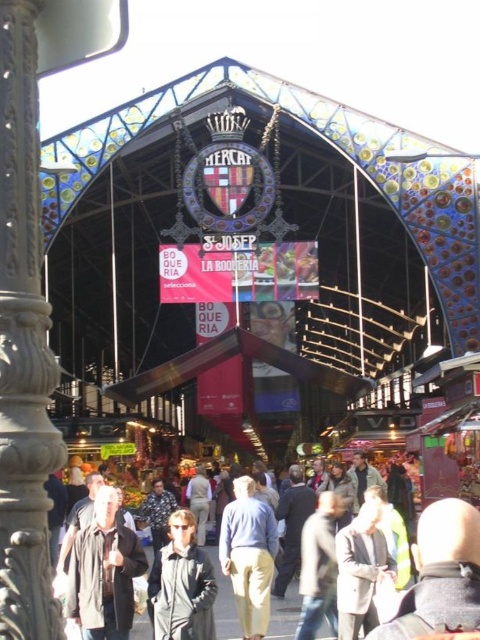
Does light blue fabric pants at center have a greater width compared to light beige coat at center?

No, light blue fabric pants at center is not wider than light beige coat at center.

Image resolution: width=480 pixels, height=640 pixels. What do you see at coordinates (249, 556) in the screenshot? I see `light blue fabric pants at center` at bounding box center [249, 556].

The image size is (480, 640). I want to click on light blue fabric pants at center, so click(x=249, y=556).

Is light brown leather jacket at center smaller than light gray wool coat at center?

No, light brown leather jacket at center is not smaller than light gray wool coat at center.

Measure the distance between light brown leather jacket at center and light gray wool coat at center.

light brown leather jacket at center is 58.13 feet from light gray wool coat at center.

Does point (166, 595) come in front of point (358, 547)?

That is True.

This screenshot has width=480, height=640. Identify the location of light brown leather jacket at center. (181, 584).

Is light brown leather jacket at center above light blue fabric pants at center?

Actually, light brown leather jacket at center is below light blue fabric pants at center.

Between light brown leather jacket at center and light blue fabric pants at center, which one has less height?

light brown leather jacket at center is shorter.

Image resolution: width=480 pixels, height=640 pixels. I want to click on light brown leather jacket at center, so click(x=181, y=584).

At what (x,y) coordinates should I click in order to perform the action: click on light brown leather jacket at center. Please return your answer as a coordinate pair (x, y). This screenshot has height=640, width=480. Looking at the image, I should click on (181, 584).